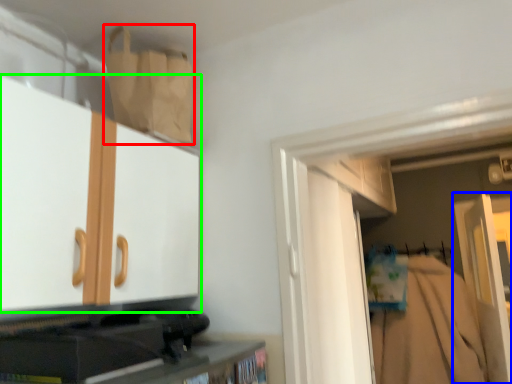
Question: Which object is positioned farthest from paper bag (highlighted by a red box)? Select from door (highlighted by a blue box) and cabinetry (highlighted by a green box).

Choices:
 (A) door
 (B) cabinetry

Answer: (A)